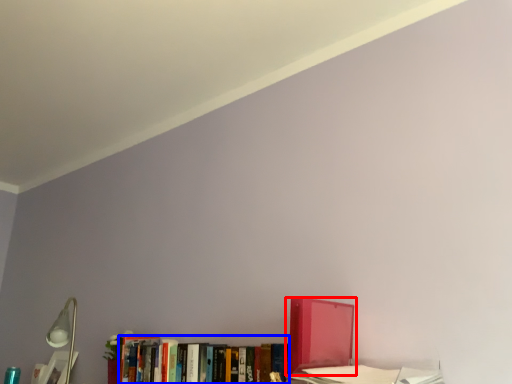
Question: Among these objects, which one is farthest to the camera, book (highlighted by a red box) or book (highlighted by a blue box)?

Choices:
 (A) book
 (B) book

Answer: (B)